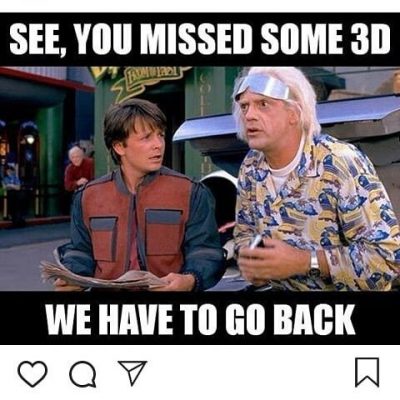
Identify the location of newspaper. (127, 282).